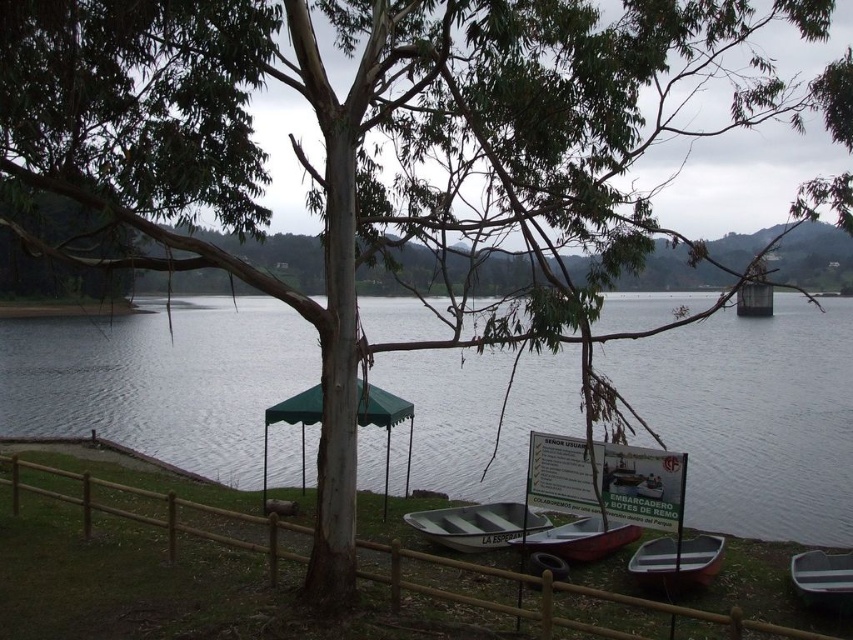
You are standing at the edge of the lake and want to move from the brown wooden fence at lower center to the green plastic boat at lower right. Given that your backpack is 2 meters wide, will you be able to carry it while moving between them without needing to adjust your backpack?

The distance between the brown wooden fence at lower center and the green plastic boat at lower right is 3.79 meters. Since your backpack is only 2 meters wide, you can easily carry it without needing to adjust because the space between them is wider than the backpack.

You are standing at the lakeside and see the green fabric umbrella at center and the white striped boat at center. Which object is taller?

The green fabric umbrella at center is taller than the white striped boat at center.